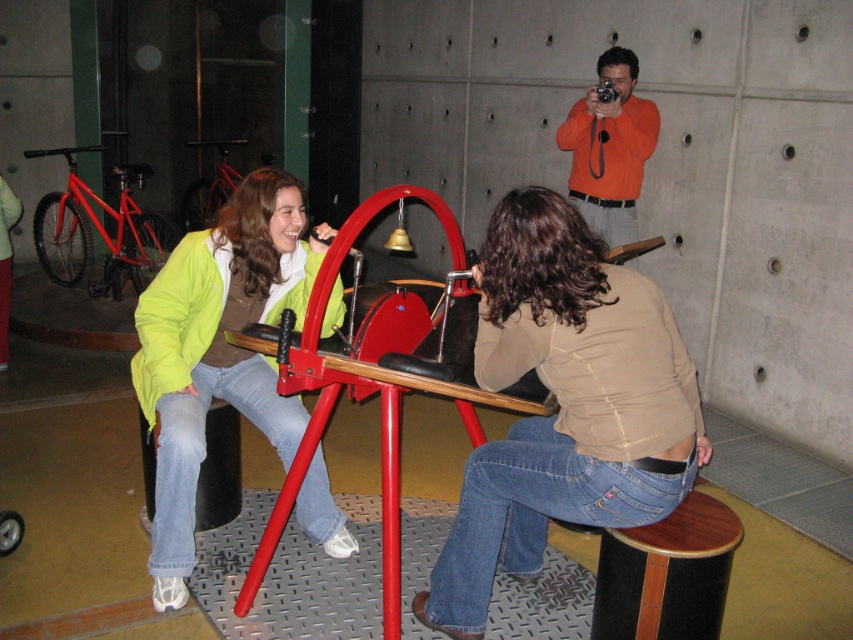
You are an observer standing in front of the recreational area. You notice the matte green jacket at center and the orange cotton shirt at upper center. Which object is positioned higher in the image?

The orange cotton shirt at upper center is positioned higher than the matte green jacket at center.

You are standing in the recreational area and see the matte green jacket at center. Can you determine its exact position relative to the central arch with the bell?

The matte green jacket at center is located at point 0.547 on the x axis and 0.257 on the y axis, which places it near the central arch with the bell.